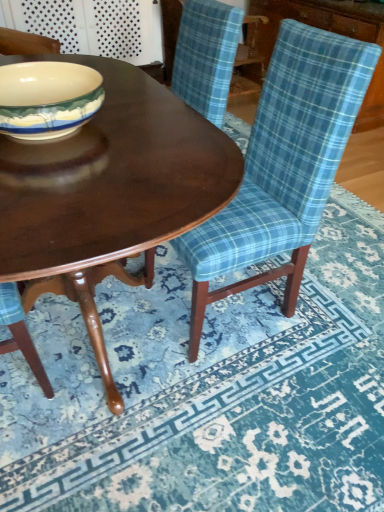
Where is `vacant space to the right of matte ceramic bowl at center-left`? The height and width of the screenshot is (512, 384). vacant space to the right of matte ceramic bowl at center-left is located at coordinates (150, 130).